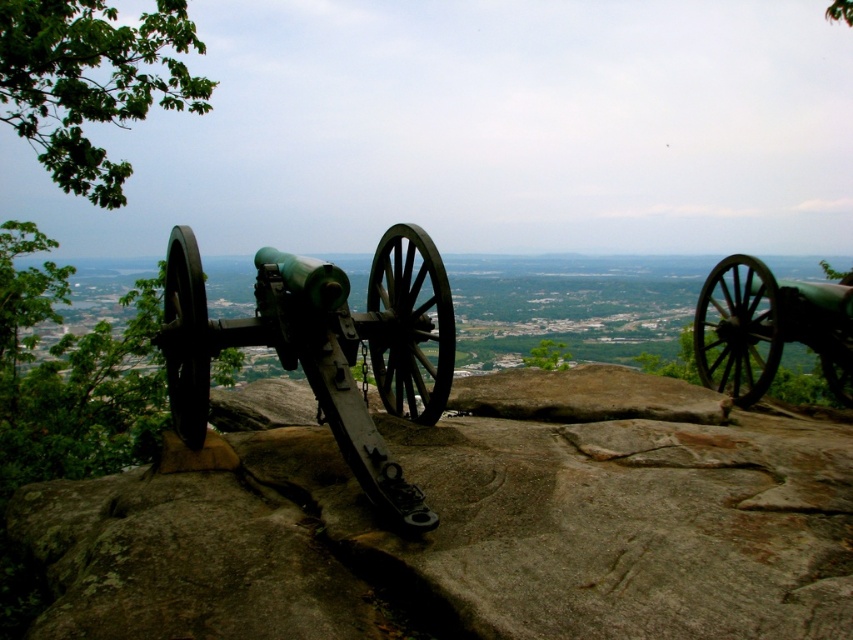
Question: Which point is closer to the camera taking this photo?

Choices:
 (A) (397, 268)
 (B) (721, 266)

Answer: (A)

Question: Can you confirm if smooth gray rock at center is positioned to the left of green matte cannon at right?

Choices:
 (A) no
 (B) yes

Answer: (B)

Question: Estimate the real-world distances between objects in this image. Which object is closer to the green matte cannon at right?

Choices:
 (A) green matte cannon at center
 (B) smooth gray rock at center

Answer: (B)

Question: From the image, what is the correct spatial relationship of green matte cannon at center in relation to green matte cannon at right?

Choices:
 (A) left
 (B) right

Answer: (A)

Question: Can you confirm if smooth gray rock at center is bigger than green matte cannon at center?

Choices:
 (A) yes
 (B) no

Answer: (B)

Question: Which point is farther from the camera taking this photo?

Choices:
 (A) (424, 513)
 (B) (480, 592)

Answer: (A)